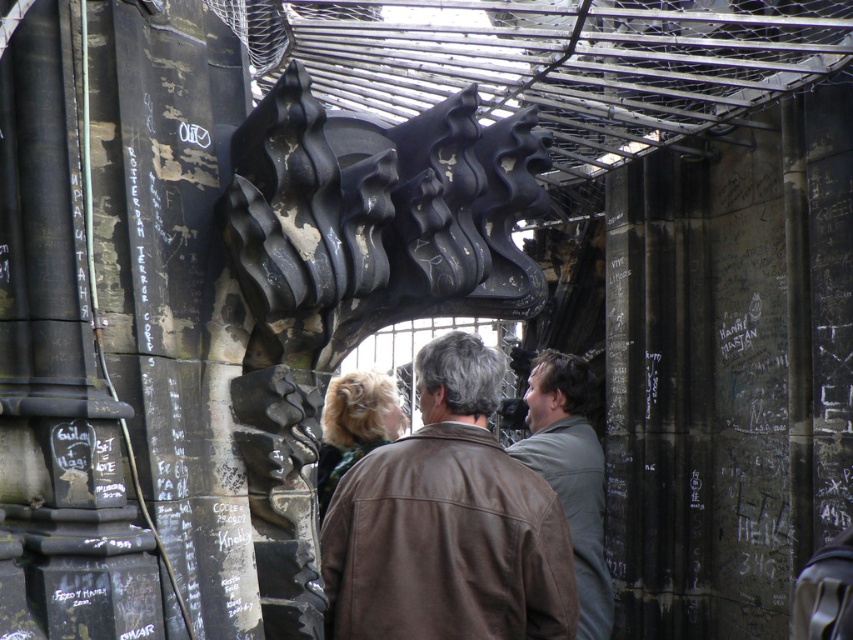
Can you confirm if brown leather jacket at center is positioned to the right of blonde hair at center?

Yes, brown leather jacket at center is to the right of blonde hair at center.

Which is in front, point (444, 422) or point (375, 410)?

Positioned in front is point (444, 422).

Between point (422, 564) and point (355, 424), which one is positioned behind?

Positioned behind is point (355, 424).

Image resolution: width=853 pixels, height=640 pixels. I want to click on brown leather jacket at center, so click(x=445, y=545).

Can you confirm if black matte sculpture at center is bigger than green matte jacket at center?

Yes, black matte sculpture at center is bigger than green matte jacket at center.

Is black matte sculpture at center shorter than green matte jacket at center?

No.

Is point (300, 477) farther from camera compared to point (560, 353)?

No, (300, 477) is closer to viewer.

In order to click on black matte sculpture at center in this screenshot , I will do `click(358, 273)`.

In the scene shown: Can you confirm if black matte sculpture at center is thinner than blonde hair at center?

No.

Is point (323, 205) closer to viewer compared to point (375, 380)?

That is True.

Image resolution: width=853 pixels, height=640 pixels. Find the location of `black matte sculpture at center`. black matte sculpture at center is located at coordinates (358, 273).